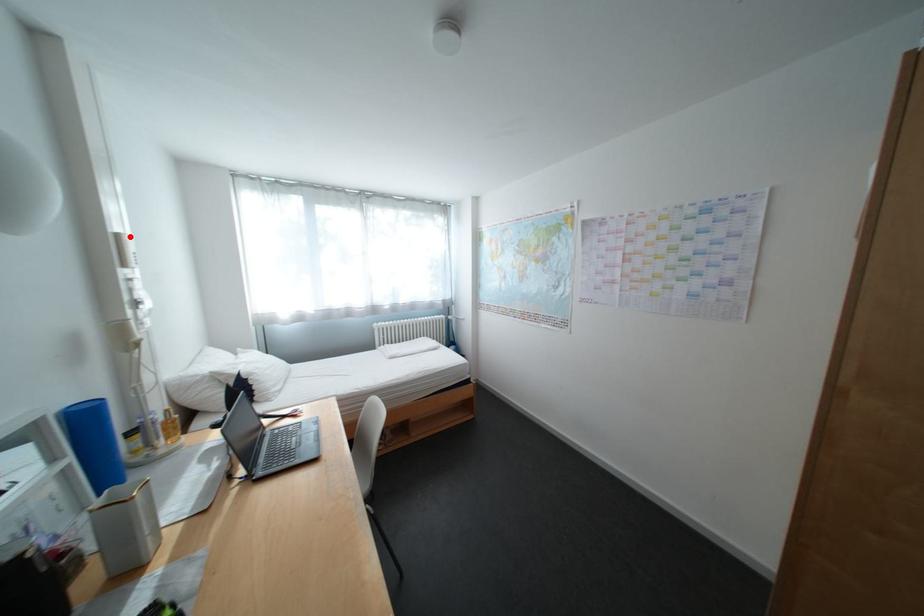
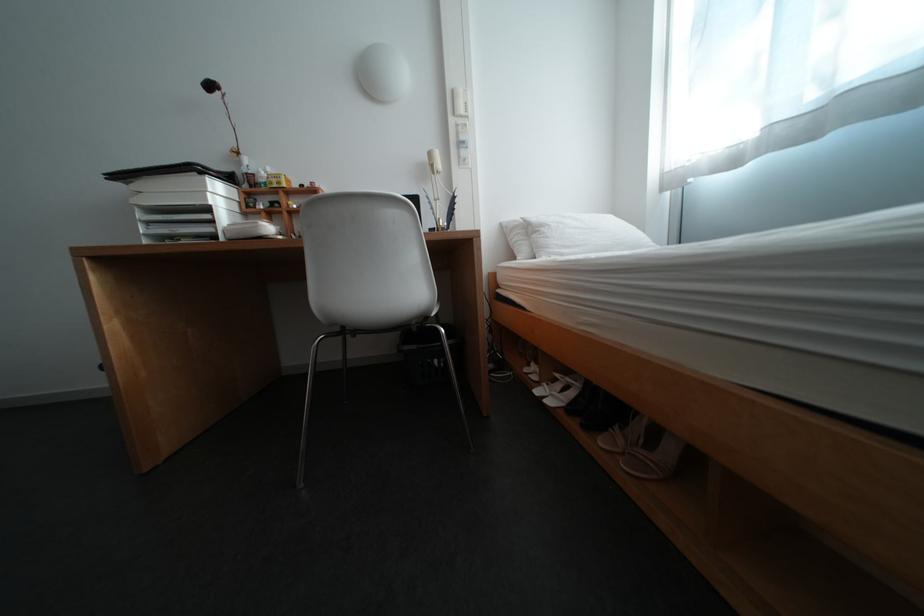
The point at the highlighted location is marked in the first image. Where is the corresponding point in the second image?

(466, 92)